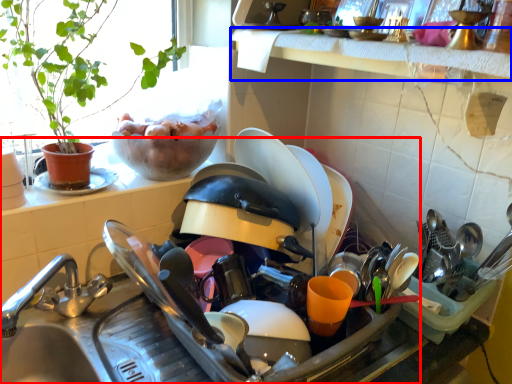
Question: Which object appears closest to the camera in this image, sink (highlighted by a red box) or window sill (highlighted by a blue box)?

Choices:
 (A) sink
 (B) window sill

Answer: (A)